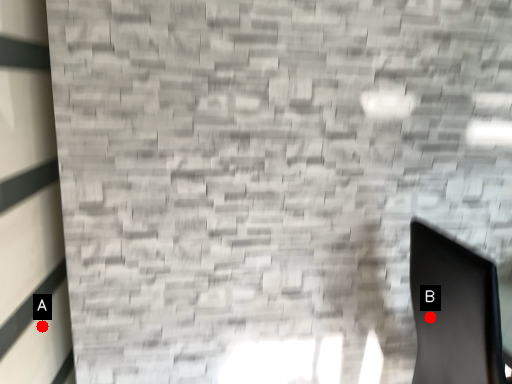
Question: Two points are circled on the image, labeled by A and B beside each circle. Which point is farther to the camera?

Choices:
 (A) A is further
 (B) B is further

Answer: (B)